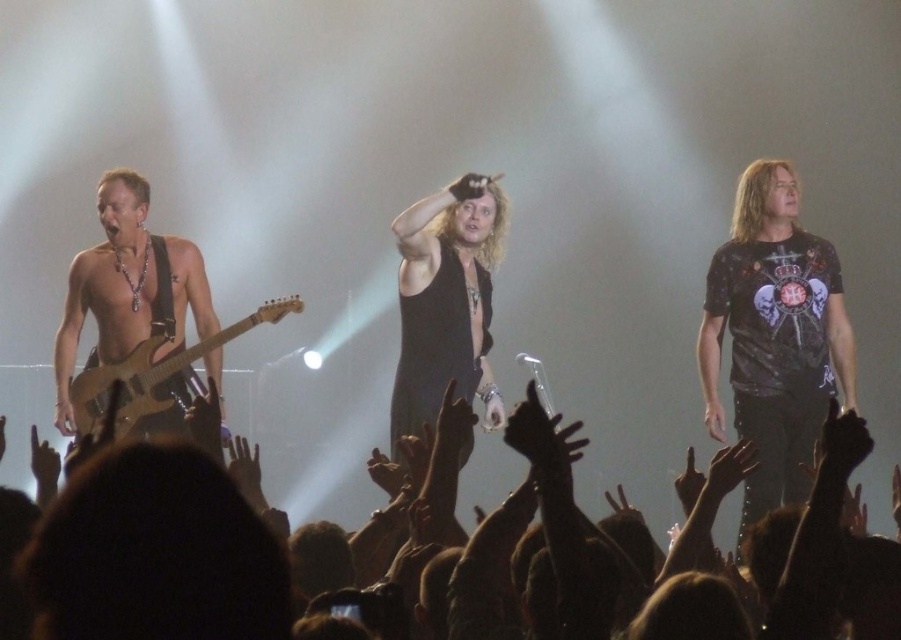
Is black leather jacket at lower center bigger than shiny silver guitar at left?

Correct, black leather jacket at lower center is larger in size than shiny silver guitar at left.

Is black leather jacket at lower center below shiny silver guitar at left?

Correct, black leather jacket at lower center is located below shiny silver guitar at left.

Image resolution: width=901 pixels, height=640 pixels. Find the location of `black leather jacket at lower center`. black leather jacket at lower center is located at coordinates (152, 548).

Does point (171, 428) lie behind point (94, 390)?

Yes, it is behind point (94, 390).

Which of these two, shiny silver guitar at left or wooden electric guitar at left, stands taller?

With more height is shiny silver guitar at left.

Who is more distant from viewer, (x=62, y=349) or (x=275, y=317)?

Point (x=62, y=349)

Find the location of a particular element. This screenshot has width=901, height=640. shiny silver guitar at left is located at coordinates click(x=126, y=285).

Is black leather jacket at lower center to the right of wooden electric guitar at left from the viewer's perspective?

Correct, you'll find black leather jacket at lower center to the right of wooden electric guitar at left.

Who is more distant from viewer, (57, 525) or (169, 353)?

The point (169, 353) is more distant.

I want to click on black leather jacket at lower center, so click(152, 548).